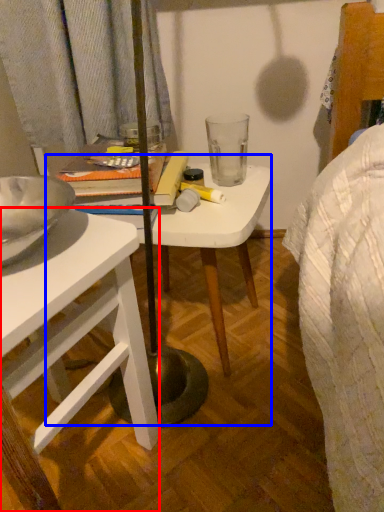
Question: Which point is further to the camera, desk (highlighted by a red box) or table (highlighted by a blue box)?

Choices:
 (A) desk
 (B) table

Answer: (B)